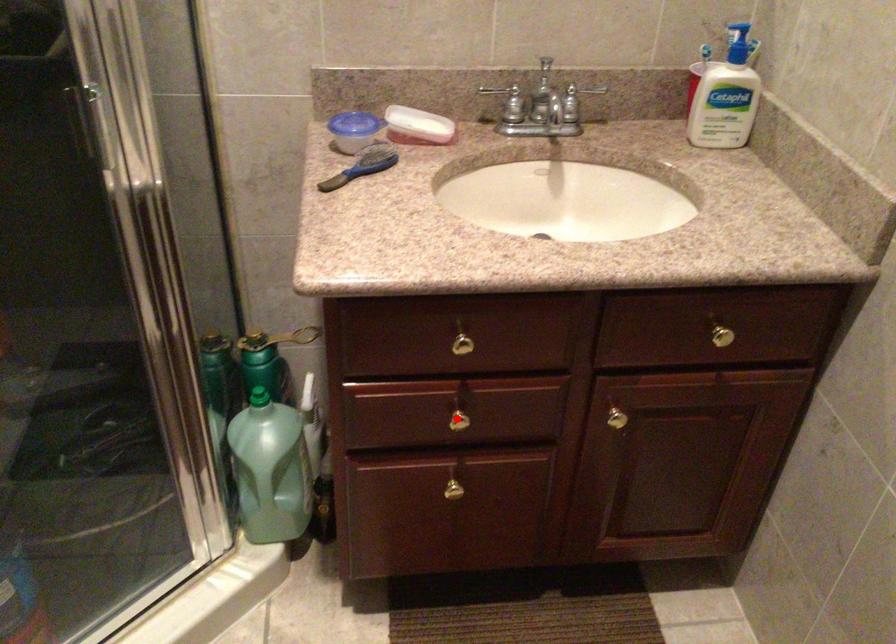
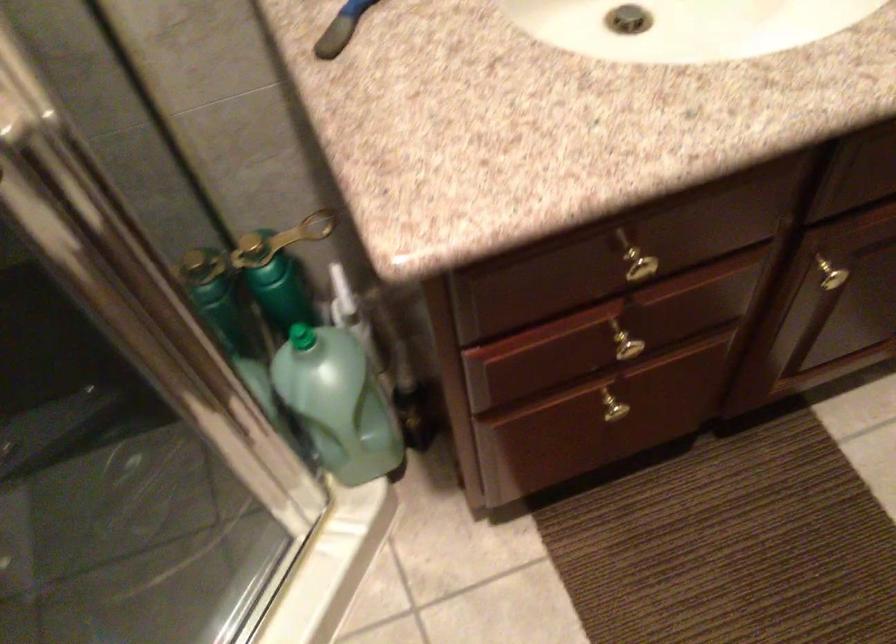
Find the pixel in the second image that matches the highlighted location in the first image.

(625, 346)